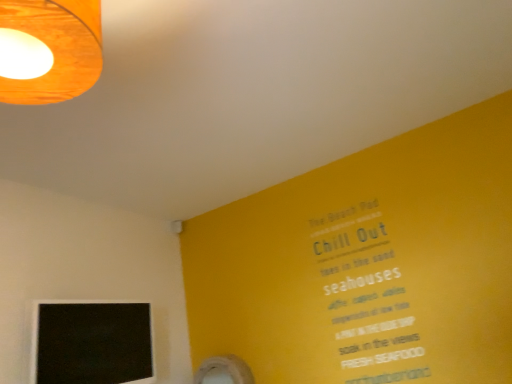
Question: Is black matte computer monitor at lower left thinner than wooden lampshade at upper left?

Choices:
 (A) yes
 (B) no

Answer: (A)

Question: Is black matte computer monitor at lower left closer to camera compared to wooden lampshade at upper left?

Choices:
 (A) yes
 (B) no

Answer: (B)

Question: Is black matte computer monitor at lower left looking in the opposite direction of wooden lampshade at upper left?

Choices:
 (A) yes
 (B) no

Answer: (B)

Question: From a real-world perspective, is black matte computer monitor at lower left on wooden lampshade at upper left?

Choices:
 (A) no
 (B) yes

Answer: (A)

Question: Can you see black matte computer monitor at lower left touching wooden lampshade at upper left?

Choices:
 (A) no
 (B) yes

Answer: (A)

Question: Is black matte computer monitor at lower left aimed at wooden lampshade at upper left?

Choices:
 (A) no
 (B) yes

Answer: (A)

Question: From the image's perspective, is wooden lampshade at upper left over black matte computer monitor at lower left?

Choices:
 (A) yes
 (B) no

Answer: (A)

Question: Considering the relative positions of wooden lampshade at upper left and black matte computer monitor at lower left in the image provided, is wooden lampshade at upper left to the right of black matte computer monitor at lower left from the viewer's perspective?

Choices:
 (A) no
 (B) yes

Answer: (B)

Question: Is there a large distance between wooden lampshade at upper left and black matte computer monitor at lower left?

Choices:
 (A) yes
 (B) no

Answer: (A)

Question: Can you confirm if wooden lampshade at upper left is positioned to the left of black matte computer monitor at lower left?

Choices:
 (A) yes
 (B) no

Answer: (B)

Question: From a real-world perspective, is wooden lampshade at upper left below black matte computer monitor at lower left?

Choices:
 (A) yes
 (B) no

Answer: (B)

Question: Can you confirm if wooden lampshade at upper left is wider than black matte computer monitor at lower left?

Choices:
 (A) yes
 (B) no

Answer: (A)

Question: From the image's perspective, relative to black matte computer monitor at lower left, is wooden lampshade at upper left above or below?

Choices:
 (A) above
 (B) below

Answer: (A)